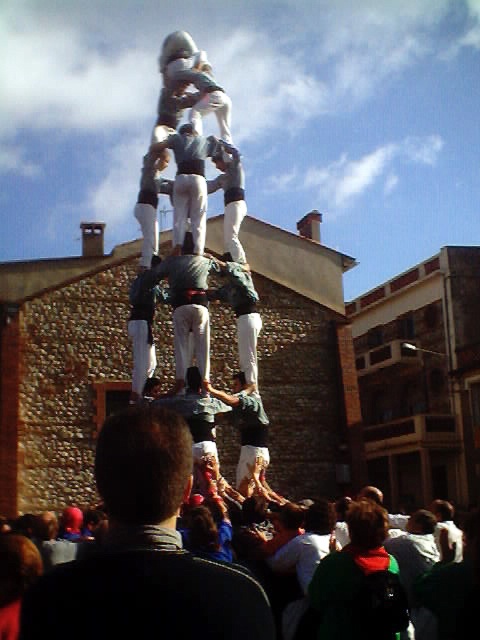
You are a photographer standing in the town square where the human tower is being built. You want to capture a closeup of the dark brown hair at center. Based on the coordinates provided, which direction should you move your camera to focus on it?

The dark brown hair at center is located at coordinates point 0.864 on the x axis and 0.302 on the y axis. To focus on it, you should move your camera to the right along the x axis and slightly downward along the y axis.